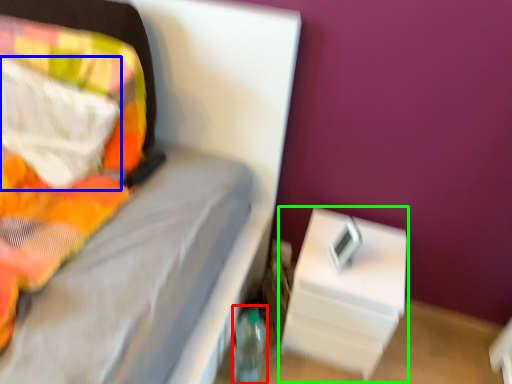
Question: Estimate the real-world distances between objects in this image. Which object is closer to bottle (highlighted by a red box), pillow (highlighted by a blue box) or nightstand (highlighted by a green box)?

Choices:
 (A) pillow
 (B) nightstand

Answer: (B)